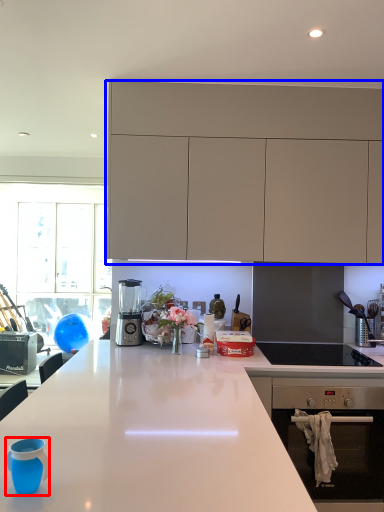
Question: Which object appears farthest to the camera in this image, teal (highlighted by a red box) or cabinetry (highlighted by a blue box)?

Choices:
 (A) teal
 (B) cabinetry

Answer: (B)